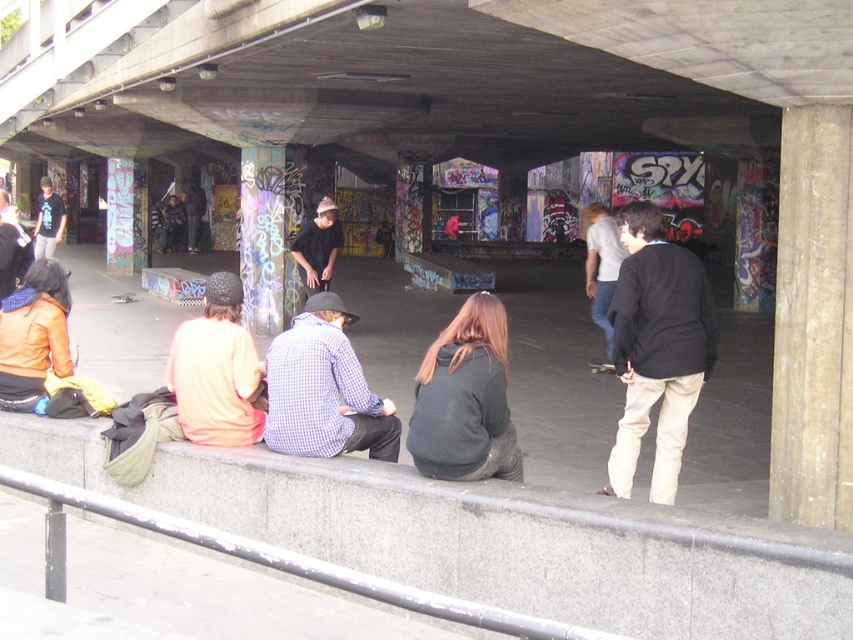
You are a photographer taking a picture of the dark brown sweater at center and the checkered fabric shirt at center. Which one is positioned higher in the image?

The dark brown sweater at center is positioned higher than the checkered fabric shirt at center.

You are a skateboarder trying to reach the ramps and ledges in the background. You see the gray concrete curb at lower center and the light brown leather jacket at center. Which object is closer to you?

The gray concrete curb at lower center is closer to you because it is positioned under the light brown leather jacket at center, indicating it is in front of the jacket.